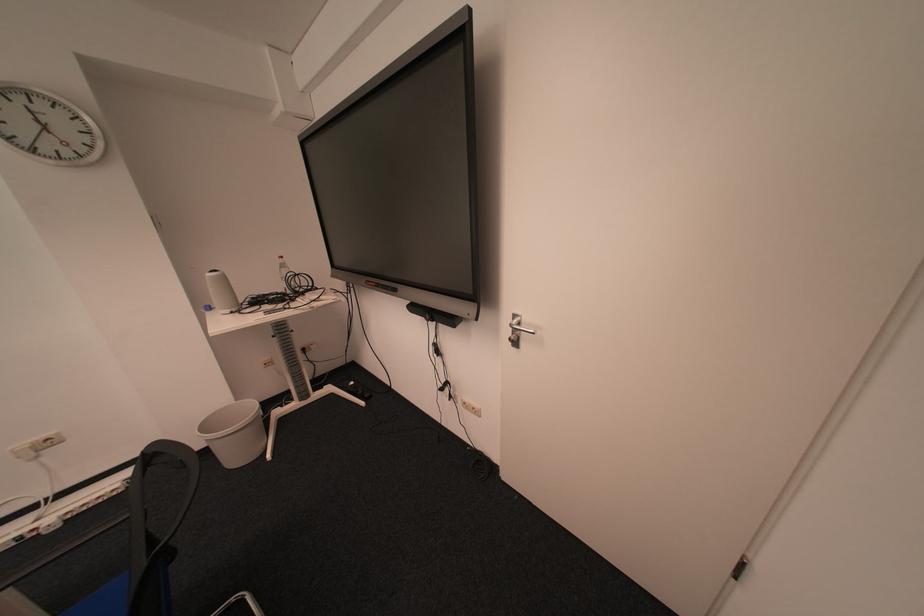
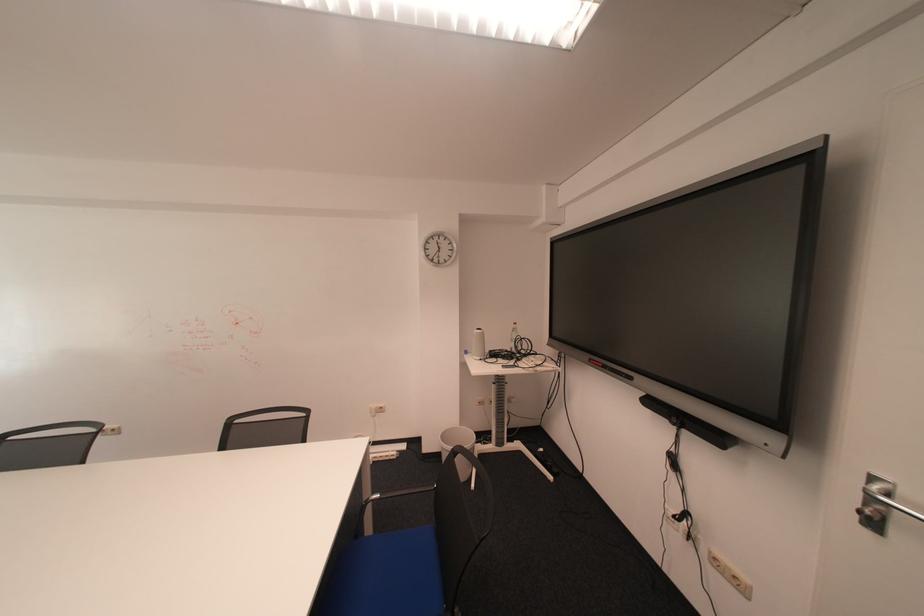
Question: The images are taken continuously from a first-person perspective. In which direction is your viewpoint rotating?

Choices:
 (A) Left
 (B) Right
 (C) Up
 (D) Down

Answer: (A)